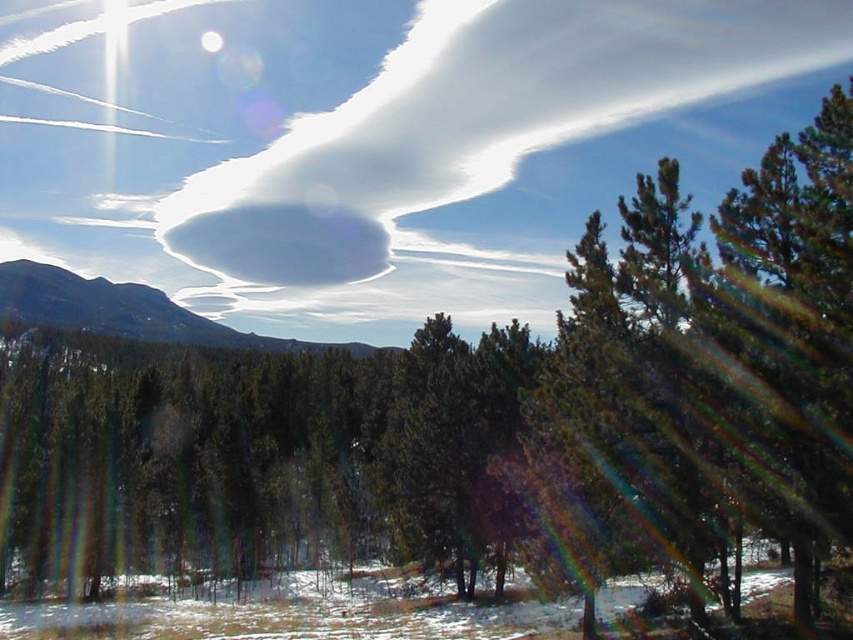
You are an astronomer observing the sky and see the white fluffy cloud at upper center and the smooth gray rock at upper left. Which object appears taller in the sky?

The white fluffy cloud at upper center is much taller than the smooth gray rock at upper left.

You are an astronomer analyzing the image. You notice the white fluffy cloud at upper center. What are its coordinates in the image?

The white fluffy cloud at upper center is located at coordinates point (476, 120).

You are a drone operator planning to fly a drone between the white fluffy cloud at upper center and the smooth gray rock at upper left. The drone has a maximum flight range of 75 meters. Can the drone safely travel between these two points without running out of battery?

The white fluffy cloud at upper center and smooth gray rock at upper left are 80.72 meters apart from each other. Since the drone can only fly up to 75 meters, it cannot safely travel between these two points without running out of battery.